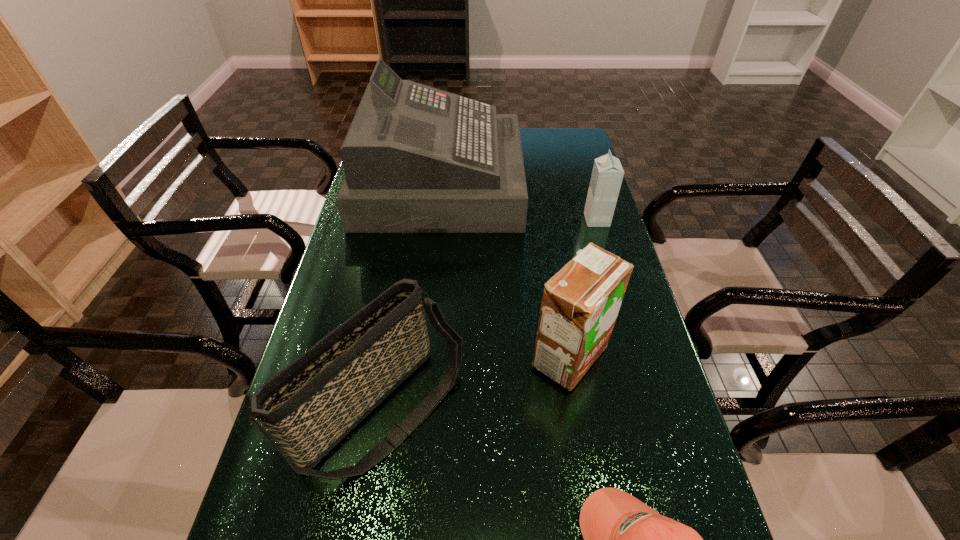
Identify the location of cash register. The width and height of the screenshot is (960, 540). click(417, 159).

Locate an element on the screen. the taller carton is located at coordinates (580, 304).

You are a GUI agent. You are given a task and a screenshot of the screen. Output one action in this format:
    pyautogui.click(x=<x>, y=<y>)
    Task: Click on the nearer carton
    This screenshot has height=540, width=960.
    Given the screenshot: What is the action you would take?
    pyautogui.click(x=580, y=304)

This screenshot has width=960, height=540. Find the location of `the farther carton`. the farther carton is located at coordinates (607, 174).

The image size is (960, 540). Identify the location of the right carton. (607, 174).

At what (x,y) coordinates should I click in order to perform the action: click on handbag. Please return your answer as a coordinate pair (x, y). The width and height of the screenshot is (960, 540). Looking at the image, I should click on (308, 407).

Where is `vacant position located on the front-facing side of the tallest object`? This screenshot has height=540, width=960. vacant position located on the front-facing side of the tallest object is located at coordinates (593, 184).

Find the location of a particular element. This screenshot has height=540, width=960. free space located on the straw side of the nearer carton is located at coordinates (506, 356).

Where is `free space located 0.220m on the straw side of the nearer carton`? This screenshot has width=960, height=540. free space located 0.220m on the straw side of the nearer carton is located at coordinates (439, 356).

Where is `free space located on the straw side of the nearer carton`? free space located on the straw side of the nearer carton is located at coordinates (427, 356).